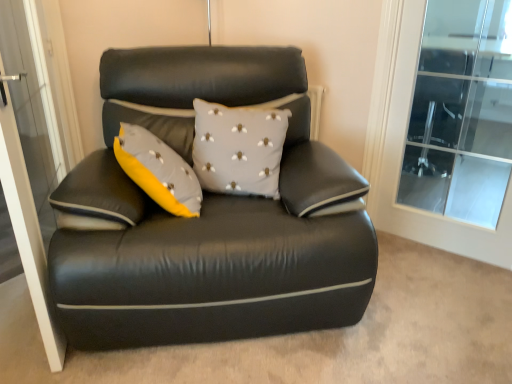
The image size is (512, 384). In order to click on black leather couch at center in this screenshot , I will do `click(209, 218)`.

From a real-world perspective, which is physically above, gray fabric cushion at center or transparent glass screen door at left?

gray fabric cushion at center is physically above.

Considering the relative sizes of gray fabric cushion at center and transparent glass screen door at left in the image provided, is gray fabric cushion at center smaller than transparent glass screen door at left?

Indeed, gray fabric cushion at center has a smaller size compared to transparent glass screen door at left.

Can you tell me how much gray fabric cushion at center and transparent glass screen door at left differ in facing direction?

115 degrees.

From a real-world perspective, is transparent glass door at upper right on top of transparent glass screen door at left?

Yes.

Considering the relative positions of transparent glass door at upper right and transparent glass screen door at left in the image provided, is transparent glass door at upper right behind transparent glass screen door at left?

Yes, transparent glass door at upper right is further from the camera.

Is transparent glass door at upper right thinner than transparent glass screen door at left?

Indeed, transparent glass door at upper right has a lesser width compared to transparent glass screen door at left.

Could you tell me if transparent glass door at upper right is facing transparent glass screen door at left?

No, transparent glass door at upper right does not turn towards transparent glass screen door at left.

Based on the photo, considering the relative sizes of transparent glass screen door at left and black leather couch at center in the image provided, is transparent glass screen door at left bigger than black leather couch at center?

Actually, transparent glass screen door at left might be smaller than black leather couch at center.

From the image's perspective, which object appears higher, transparent glass screen door at left or black leather couch at center?

From the image's view, transparent glass screen door at left is above.

What's the angular difference between transparent glass screen door at left and black leather couch at center's facing directions?

They differ by 96.8 degrees in their facing directions.

Is transparent glass screen door at left positioned behind black leather couch at center?

No, transparent glass screen door at left is in front of black leather couch at center.

Is black leather couch at center thinner than gray fabric cushion at center?

Incorrect, the width of black leather couch at center is not less than that of gray fabric cushion at center.

Is black leather couch at center spatially inside gray fabric cushion at center, or outside of it?

black leather couch at center is not enclosed by gray fabric cushion at center.

Is point (79, 235) farther from camera compared to point (201, 186)?

That is False.

Find the location of `studio couch that is under the gray fabric cushion at center (from a real-world perspective)`. studio couch that is under the gray fabric cushion at center (from a real-world perspective) is located at coordinates (209, 218).

This screenshot has height=384, width=512. In the image, there is a gray fabric cushion at center. In order to click on screen door below it (from a real-world perspective) in this screenshot , I will do `click(35, 143)`.

Is transparent glass screen door at left surrounding gray fabric cushion at center?

Actually, gray fabric cushion at center is outside transparent glass screen door at left.

Considering the relative positions of transparent glass screen door at left and gray fabric cushion at center in the image provided, is transparent glass screen door at left to the right of gray fabric cushion at center from the viewer's perspective?

No.

Would you consider transparent glass screen door at left to be distant from gray fabric cushion at center?

transparent glass screen door at left is actually quite close to gray fabric cushion at center.

From a real-world perspective, is transparent glass door at upper right physically below black leather couch at center?

No, from a real-world perspective, transparent glass door at upper right is not below black leather couch at center.

Would you say transparent glass door at upper right is outside black leather couch at center?

Yes.

Who is smaller, transparent glass door at upper right or black leather couch at center?

Smaller between the two is transparent glass door at upper right.

This screenshot has width=512, height=384. In order to click on window that is on the right side of black leather couch at center in this screenshot , I will do `click(461, 112)`.

Can you confirm if gray fabric cushion at center is positioned to the right of black leather couch at center?

Indeed, gray fabric cushion at center is positioned on the right side of black leather couch at center.

Are gray fabric cushion at center and black leather couch at center far apart?

gray fabric cushion at center is near black leather couch at center, not far away.

Is gray fabric cushion at center facing away from black leather couch at center?

Yes, gray fabric cushion at center is facing away from black leather couch at center.

From the image's perspective, is gray fabric cushion at center beneath black leather couch at center?

No, from the image's perspective, gray fabric cushion at center is not below black leather couch at center.

Where is `pillow that appears on the right of transparent glass screen door at left`? pillow that appears on the right of transparent glass screen door at left is located at coordinates (238, 148).

At what (x,y) coordinates should I click in order to perform the action: click on screen door located below the transparent glass door at upper right (from the image's perspective). Please return your answer as a coordinate pair (x, y). The image size is (512, 384). Looking at the image, I should click on (35, 143).

Estimate the real-world distances between objects in this image. Which object is further from black leather couch at center, transparent glass screen door at left or gray fabric cushion at center?

transparent glass screen door at left lies further to black leather couch at center than the other object.

Based on their spatial positions, is black leather couch at center or transparent glass screen door at left closer to gray fabric cushion at center?

black leather couch at center is positioned closer to the anchor gray fabric cushion at center.

Based on their spatial positions, is transparent glass door at upper right or gray fabric cushion at center closer to transparent glass screen door at left?

gray fabric cushion at center is closer to transparent glass screen door at left.

Based on their spatial positions, is gray fabric cushion at center or transparent glass screen door at left closer to black leather couch at center?

Based on the image, gray fabric cushion at center appears to be nearer to black leather couch at center.

Which object lies nearer to the anchor point transparent glass door at upper right, gray fabric cushion at center or transparent glass screen door at left?

gray fabric cushion at center.

Which object lies further to the anchor point transparent glass door at upper right, black leather couch at center or transparent glass screen door at left?

Among the two, transparent glass screen door at left is located further to transparent glass door at upper right.

Estimate the real-world distances between objects in this image. Which object is further from transparent glass door at upper right, black leather couch at center or gray fabric cushion at center?

Among the two, gray fabric cushion at center is located further to transparent glass door at upper right.

From the image, which object appears to be nearer to gray fabric cushion at center, transparent glass screen door at left or transparent glass door at upper right?

Among the two, transparent glass screen door at left is located nearer to gray fabric cushion at center.

The width and height of the screenshot is (512, 384). Identify the location of pillow between black leather couch at center and transparent glass door at upper right from left to right. (x=238, y=148).

At what (x,y) coordinates should I click in order to perform the action: click on studio couch located between transparent glass screen door at left and gray fabric cushion at center in the left-right direction. Please return your answer as a coordinate pair (x, y). The image size is (512, 384). Looking at the image, I should click on (209, 218).

This screenshot has width=512, height=384. Find the location of `pillow situated between transparent glass screen door at left and transparent glass door at upper right from left to right`. pillow situated between transparent glass screen door at left and transparent glass door at upper right from left to right is located at coordinates (238, 148).

The height and width of the screenshot is (384, 512). In order to click on studio couch located between transparent glass screen door at left and transparent glass door at upper right in the left-right direction in this screenshot , I will do `click(209, 218)`.